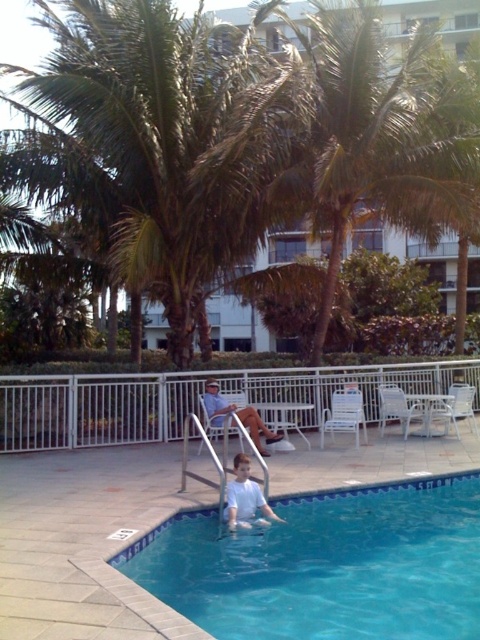
Which is above, white matte shirt at lower center or white fabric chair at center?

white fabric chair at center

Can you confirm if white matte shirt at lower center is positioned to the right of white fabric chair at center?

Correct, you'll find white matte shirt at lower center to the right of white fabric chair at center.

This screenshot has width=480, height=640. Describe the element at coordinates (245, 497) in the screenshot. I see `white matte shirt at lower center` at that location.

The height and width of the screenshot is (640, 480). Find the location of `white matte shirt at lower center`. white matte shirt at lower center is located at coordinates (245, 497).

In the scene shown: Does blue glossy water at center lie behind green leafy palm tree at center?

No, it is in front of green leafy palm tree at center.

Is point (451, 586) less distant than point (335, 179)?

That is True.

Locate an element on the screen. Image resolution: width=480 pixels, height=640 pixels. blue glossy water at center is located at coordinates (325, 564).

Can you confirm if green leafy palm tree at center is bigger than white matte shirt at lower center?

No, green leafy palm tree at center is not bigger than white matte shirt at lower center.

Between green leafy palm tree at center and white matte shirt at lower center, which one appears on the left side from the viewer's perspective?

Positioned to the left is white matte shirt at lower center.

Image resolution: width=480 pixels, height=640 pixels. In order to click on green leafy palm tree at center in this screenshot , I will do `click(383, 134)`.